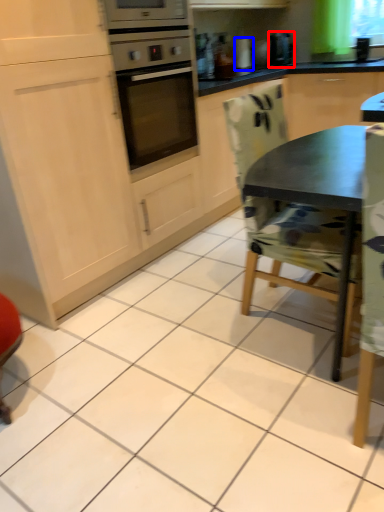
Question: Which point is closer to the camera, coffee machine (highlighted by a red box) or appliance (highlighted by a blue box)?

Choices:
 (A) coffee machine
 (B) appliance

Answer: (A)